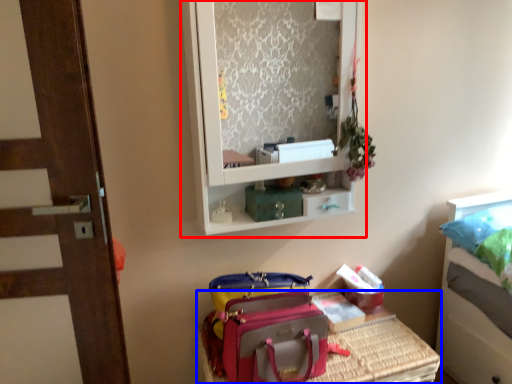
Question: Which point is closer to the camera, medicine cabinet (highlighted by a red box) or furniture (highlighted by a blue box)?

Choices:
 (A) medicine cabinet
 (B) furniture

Answer: (A)